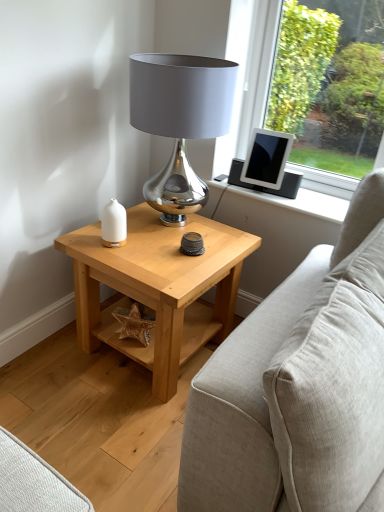
Measure the distance between beige fabric couch at right and camera.

beige fabric couch at right is 29.94 inches from camera.

Identify the location of matte black tablet at upper right. Image resolution: width=384 pixels, height=512 pixels. (267, 158).

Image resolution: width=384 pixels, height=512 pixels. Describe the element at coordinates (180, 121) in the screenshot. I see `shiny metallic lamp at center` at that location.

Find the location of a particular element. The width and height of the screenshot is (384, 512). light wood/texture side table at center is located at coordinates coord(158,287).

Looking at this image, choose the correct answer: Is shiny metallic lamp at center inside white matte candle holder at left or outside it?

shiny metallic lamp at center is located beyond the bounds of white matte candle holder at left.

Is there a large distance between shiny metallic lamp at center and white matte candle holder at left?

No.

Which object is wider, shiny metallic lamp at center or white matte candle holder at left?

shiny metallic lamp at center.

Between shiny metallic lamp at center and white matte candle holder at left, which one has less height?

With less height is white matte candle holder at left.

Considering the relative sizes of white matte candle holder at left and matte black tablet at upper right in the image provided, is white matte candle holder at left thinner than matte black tablet at upper right?

Indeed, white matte candle holder at left has a lesser width compared to matte black tablet at upper right.

From the picture: Measure the distance between white matte candle holder at left and matte black tablet at upper right.

27.10 inches.

From a real-world perspective, who is located lower, white matte candle holder at left or matte black tablet at upper right?

From a 3D spatial view, white matte candle holder at left is below.

Is white matte candle holder at left shorter than matte black tablet at upper right?

Indeed, white matte candle holder at left has a lesser height compared to matte black tablet at upper right.

Is point (371, 457) positioned in front of point (103, 225)?

That is True.

Considering the sizes of objects beige fabric couch at right and white matte candle holder at left in the image provided, who is thinner, beige fabric couch at right or white matte candle holder at left?

white matte candle holder at left is thinner.

Is beige fabric couch at right not within white matte candle holder at left?

Absolutely, beige fabric couch at right is external to white matte candle holder at left.

From the image's perspective, is beige fabric couch at right above or below white matte candle holder at left?

Based on their image positions, beige fabric couch at right is located beneath white matte candle holder at left.

What's the angular difference between shiny metallic lamp at center and matte black tablet at upper right's facing directions?

36.7 degrees.

Between shiny metallic lamp at center and matte black tablet at upper right, which one has larger size?

shiny metallic lamp at center is bigger.

Is shiny metallic lamp at center oriented away from matte black tablet at upper right?

No, shiny metallic lamp at center is not facing away from matte black tablet at upper right.

Looking at this image, is beige fabric couch at right oriented away from light wood/texture side table at center?

That's right, beige fabric couch at right is facing away from light wood/texture side table at center.

Considering the relative sizes of beige fabric couch at right and light wood/texture side table at center in the image provided, is beige fabric couch at right shorter than light wood/texture side table at center?

Incorrect, the height of beige fabric couch at right does not fall short of that of light wood/texture side table at center.

In the scene shown: Is light wood/texture side table at center inside beige fabric couch at right?

Actually, light wood/texture side table at center is outside beige fabric couch at right.

Considering the relative positions of beige fabric couch at right and light wood/texture side table at center in the image provided, is beige fabric couch at right to the left of light wood/texture side table at center from the viewer's perspective?

In fact, beige fabric couch at right is to the right of light wood/texture side table at center.

How many degrees apart are the facing directions of white matte candle holder at left and light wood/texture side table at center?

46.5 degrees.

From a real-world perspective, which is physically below, white matte candle holder at left or light wood/texture side table at center?

In real-world perspective, light wood/texture side table at center is lower.

Are white matte candle holder at left and light wood/texture side table at center located far from each other?

No, white matte candle holder at left is in close proximity to light wood/texture side table at center.

Looking at this image, between white matte candle holder at left and light wood/texture side table at center, which one has larger size?

Bigger between the two is light wood/texture side table at center.

Is matte black tablet at upper right not close to beige fabric couch at right?

That's not correct — matte black tablet at upper right is a little close to beige fabric couch at right.

Could beige fabric couch at right be considered to be inside matte black tablet at upper right?

That's incorrect, beige fabric couch at right is not inside matte black tablet at upper right.

Considering the relative positions of matte black tablet at upper right and beige fabric couch at right in the image provided, is matte black tablet at upper right to the left of beige fabric couch at right from the viewer's perspective?

Correct, you'll find matte black tablet at upper right to the left of beige fabric couch at right.

From the image's perspective, is matte black tablet at upper right on top of beige fabric couch at right?

Indeed, from the image's perspective, matte black tablet at upper right is shown above beige fabric couch at right.

There is a white matte candle holder at left. What are the coordinates of `lamp above it (from a real-world perspective)` in the screenshot? It's located at (180, 121).

Image resolution: width=384 pixels, height=512 pixels. Identify the location of candle holder on the left of the matte black tablet at upper right. (113, 224).

Which object lies further to the anchor point white matte candle holder at left, light wood/texture side table at center or shiny metallic lamp at center?

Among the two, shiny metallic lamp at center is located further to white matte candle holder at left.

Based on their spatial positions, is light wood/texture side table at center or shiny metallic lamp at center closer to matte black tablet at upper right?

The object closer to matte black tablet at upper right is shiny metallic lamp at center.

Which object lies further to the anchor point white matte candle holder at left, beige fabric couch at right or shiny metallic lamp at center?

beige fabric couch at right is positioned further to the anchor white matte candle holder at left.

From the image, which object appears to be nearer to light wood/texture side table at center, white matte candle holder at left or matte black tablet at upper right?

white matte candle holder at left.

When comparing their distances from white matte candle holder at left, does matte black tablet at upper right or light wood/texture side table at center seem further?

Based on the image, matte black tablet at upper right appears to be further to white matte candle holder at left.

When comparing their distances from light wood/texture side table at center, does shiny metallic lamp at center or matte black tablet at upper right seem closer?

shiny metallic lamp at center is positioned closer to the anchor light wood/texture side table at center.

Which object lies nearer to the anchor point light wood/texture side table at center, white matte candle holder at left or beige fabric couch at right?

white matte candle holder at left lies closer to light wood/texture side table at center than the other object.

Which object lies nearer to the anchor point matte black tablet at upper right, light wood/texture side table at center or beige fabric couch at right?

light wood/texture side table at center is closer to matte black tablet at upper right.

Locate an element on the screen. This screenshot has width=384, height=512. candle holder positioned between beige fabric couch at right and matte black tablet at upper right from near to far is located at coordinates (113, 224).

This screenshot has height=512, width=384. Find the location of `table between white matte candle holder at left and matte black tablet at upper right in the horizontal direction`. table between white matte candle holder at left and matte black tablet at upper right in the horizontal direction is located at coordinates tap(158, 287).

At what (x,y) coordinates should I click in order to perform the action: click on lamp located between beige fabric couch at right and white matte candle holder at left in the depth direction. Please return your answer as a coordinate pair (x, y). The width and height of the screenshot is (384, 512). Looking at the image, I should click on (180, 121).

Locate an element on the screen. table located between beige fabric couch at right and matte black tablet at upper right in the depth direction is located at coordinates (158, 287).